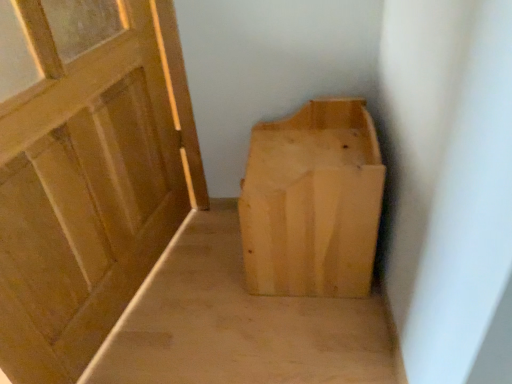
At what (x,y) coordinates should I click in order to perform the action: click on free spot below matte wood door at left (from a real-world perspective). Please return your answer as a coordinate pair (x, y). Looking at the image, I should click on pos(127,304).